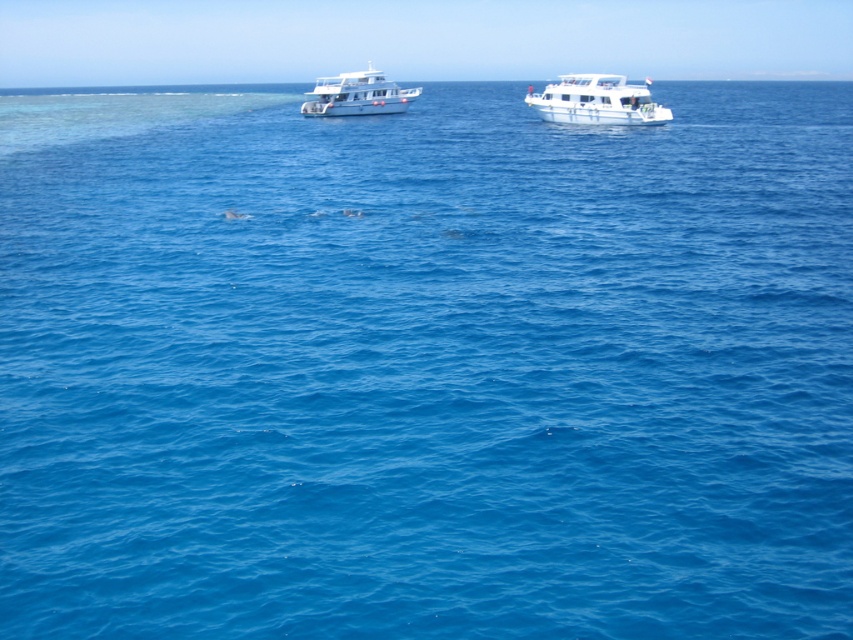
Question: Which object appears closest to the camera in this image?

Choices:
 (A) white glossy boat at upper center
 (B) white glossy boat at upper right

Answer: (B)

Question: Does white glossy boat at upper right have a larger size compared to white glossy boat at upper center?

Choices:
 (A) no
 (B) yes

Answer: (A)

Question: Can you confirm if white glossy boat at upper right is bigger than white glossy boat at upper center?

Choices:
 (A) yes
 (B) no

Answer: (B)

Question: Which of the following is the closest to the observer?

Choices:
 (A) white glossy boat at upper center
 (B) white glossy boat at upper right

Answer: (B)

Question: Is white glossy boat at upper right thinner than white glossy boat at upper center?

Choices:
 (A) no
 (B) yes

Answer: (B)